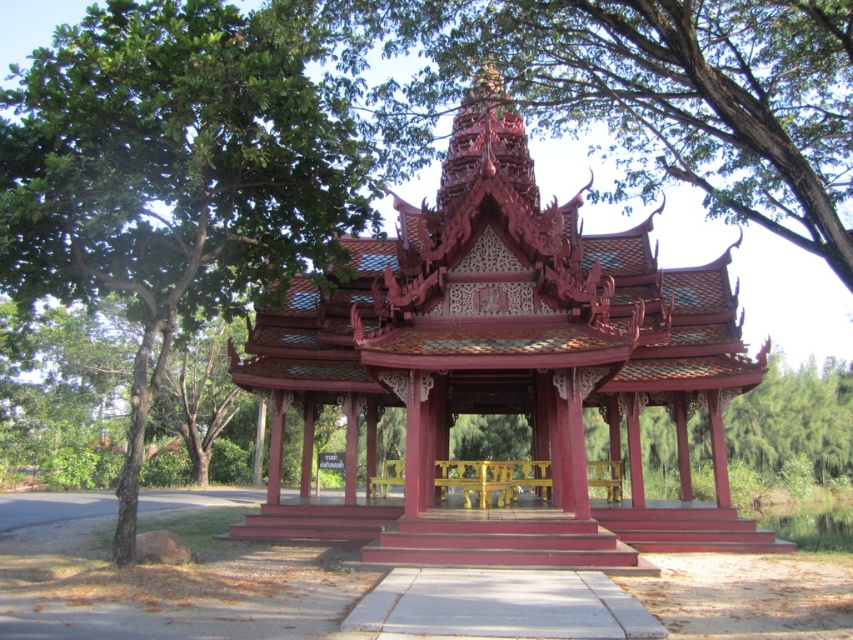
From the picture: Is glossy wood gazebo at center bigger than green leafy tree at upper left?

Incorrect, glossy wood gazebo at center is not larger than green leafy tree at upper left.

Is glossy wood gazebo at center taller than green leafy tree at upper left?

No, glossy wood gazebo at center is not taller than green leafy tree at upper left.

Does point (550, 554) lie in front of point (257, 164)?

That is False.

Where is `glossy wood gazebo at center`? glossy wood gazebo at center is located at coordinates 503,371.